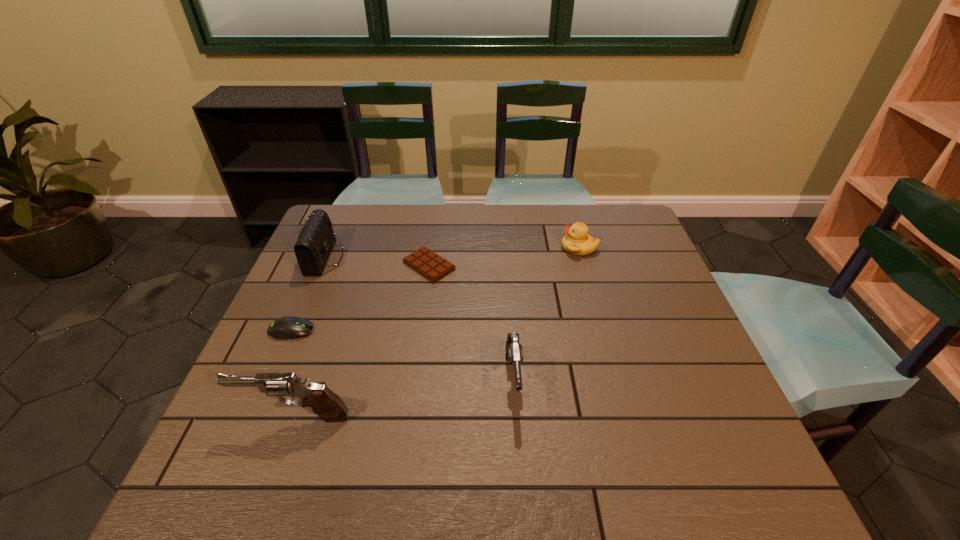
The height and width of the screenshot is (540, 960). What are the coordinates of `pistol that is at the left edge` in the screenshot? It's located at (329, 407).

At what (x,y) coordinates should I click in order to perform the action: click on clutch bag situated at the left edge. Please return your answer as a coordinate pair (x, y). Image resolution: width=960 pixels, height=540 pixels. Looking at the image, I should click on (315, 241).

You are a GUI agent. You are given a task and a screenshot of the screen. Output one action in this format:
    pyautogui.click(x=<x>, y=<y>)
    Task: Click on the computer mouse present at the left edge
    This screenshot has height=540, width=960.
    Given the screenshot: What is the action you would take?
    pyautogui.click(x=285, y=328)

The width and height of the screenshot is (960, 540). What are the coordinates of `object present at the far left corner` in the screenshot? It's located at (315, 241).

This screenshot has width=960, height=540. I want to click on object located at the near left corner, so click(329, 407).

The height and width of the screenshot is (540, 960). In the image, there is a desktop. Find the location of `vacant space at the far edge`. vacant space at the far edge is located at coordinates tap(399, 205).

Locate an element on the screen. The height and width of the screenshot is (540, 960). vacant region at the near edge of the desktop is located at coordinates (586, 405).

This screenshot has width=960, height=540. Find the location of `free space at the left edge of the desktop`. free space at the left edge of the desktop is located at coordinates (318, 293).

Find the location of a particular element. This screenshot has height=540, width=960. vacant space at the right edge of the desktop is located at coordinates pyautogui.click(x=639, y=253).

At what (x,y) coordinates should I click in order to perform the action: click on free region at the far left corner of the desktop. Please return your answer as a coordinate pair (x, y). This screenshot has height=540, width=960. Looking at the image, I should click on (356, 219).